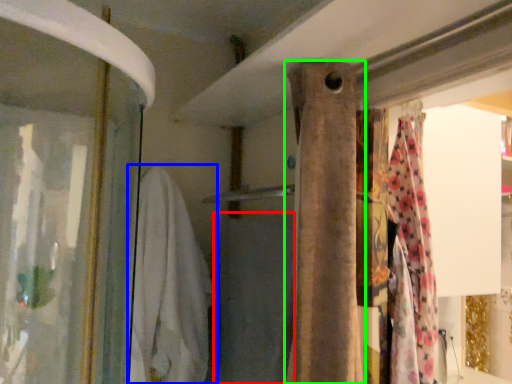
Question: Based on their relative distances, which object is farther from bath towel (highlighted by a red box)? Choose from clothing (highlighted by a blue box) and curtain (highlighted by a green box).

Choices:
 (A) clothing
 (B) curtain

Answer: (B)